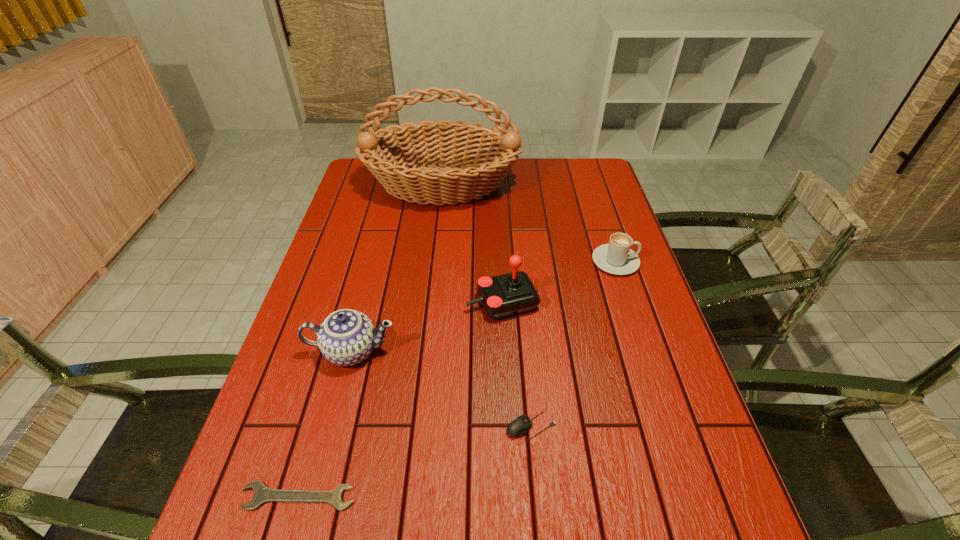
Find the location of a particular element. The width and height of the screenshot is (960, 540). vacant area that lies between the third tallest object and the second farthest object is located at coordinates (484, 306).

Locate an element on the screen. Image resolution: width=960 pixels, height=540 pixels. vacant space that's between the third nearest object and the basket is located at coordinates (396, 268).

Locate an element on the screen. The height and width of the screenshot is (540, 960). empty space between the wrench and the mouse is located at coordinates (415, 461).

You are a GUI agent. You are given a task and a screenshot of the screen. Output one action in this format:
    pyautogui.click(x=<x>, y=<y>)
    Task: Click on the empty space that is in between the basket and the third farthest object
    
    Given the screenshot: What is the action you would take?
    pyautogui.click(x=472, y=244)

Image resolution: width=960 pixels, height=540 pixels. Identify the location of empty space that is in between the cappuccino and the fifth farthest object. (573, 343).

Image resolution: width=960 pixels, height=540 pixels. What are the coordinates of `free spot between the joystick and the rightmost object` in the screenshot? It's located at (559, 282).

This screenshot has width=960, height=540. What are the coordinates of `object that is the fifth closest to the fifth farthest object` in the screenshot? It's located at (400, 167).

Where is `object that stands as the fourth closest to the third farthest object`? object that stands as the fourth closest to the third farthest object is located at coordinates (400, 167).